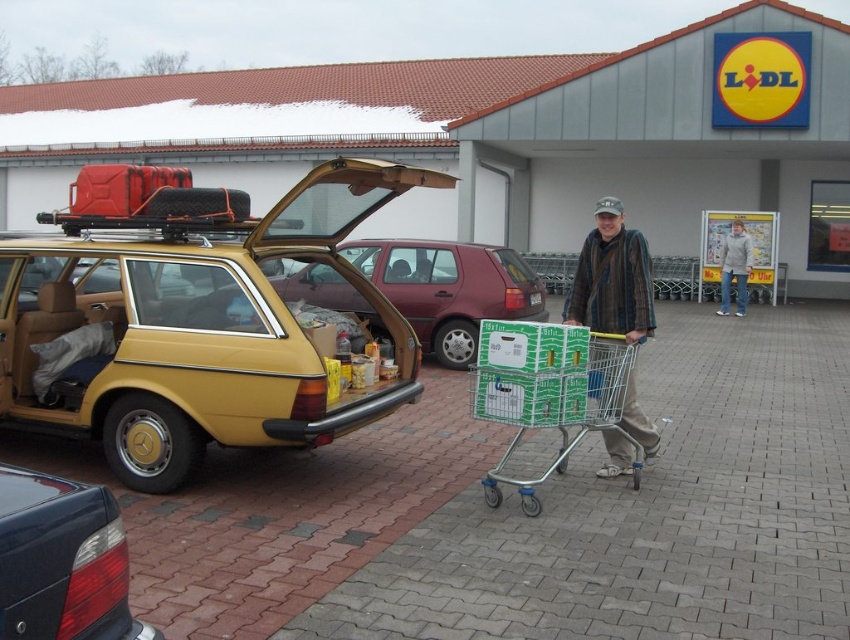
Question: Which is farther from the shiny black tail light at lower left?

Choices:
 (A) gold metallic station wagon at center
 (B) metallic red minivan at center
 (C) striped fabric jacket at center

Answer: (B)

Question: Can you confirm if metallic red minivan at center is smaller than striped fabric jacket at center?

Choices:
 (A) yes
 (B) no

Answer: (B)

Question: Which point is farther to the camera?

Choices:
 (A) (636, 250)
 (B) (366, 365)
 (C) (323, 272)

Answer: (C)

Question: Which object appears farthest from the camera in this image?

Choices:
 (A) shiny black tail light at lower left
 (B) metallic silver shopping cart at center

Answer: (B)

Question: Where is gold metallic station wagon at center located in relation to striped fabric jacket at center in the image?

Choices:
 (A) below
 (B) above

Answer: (B)

Question: Can you confirm if shiny black tail light at lower left is bigger than gray woolen sweater at center?

Choices:
 (A) no
 (B) yes

Answer: (A)